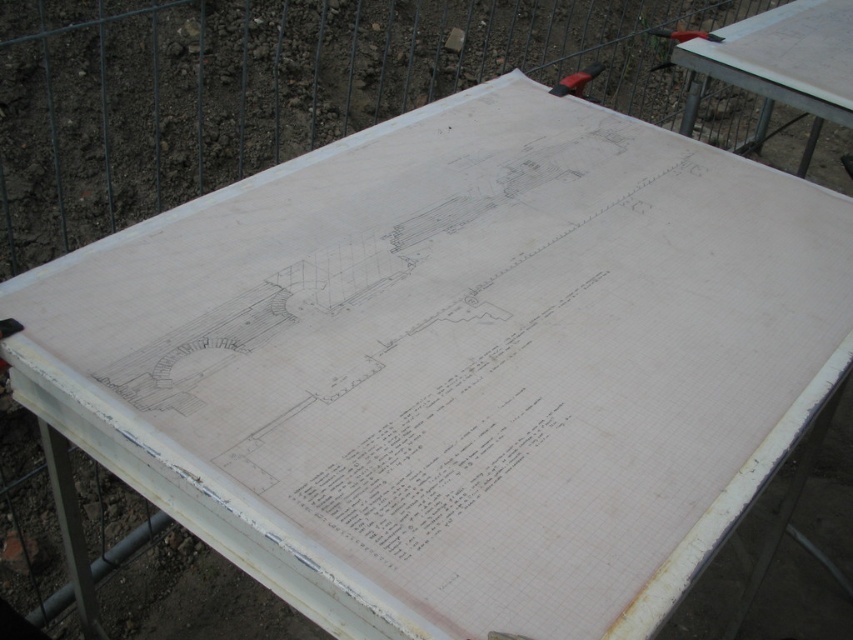
Can you confirm if white paper at upper right is positioned to the right of metallic red hammer at upper right?

Correct, you'll find white paper at upper right to the right of metallic red hammer at upper right.

Is white paper at upper right in front of metallic red hammer at upper right?

Yes, it is in front of metallic red hammer at upper right.

Describe the element at coordinates (785, 60) in the screenshot. I see `white paper at upper right` at that location.

This screenshot has height=640, width=853. In order to click on white paper at upper right in this screenshot , I will do `click(785, 60)`.